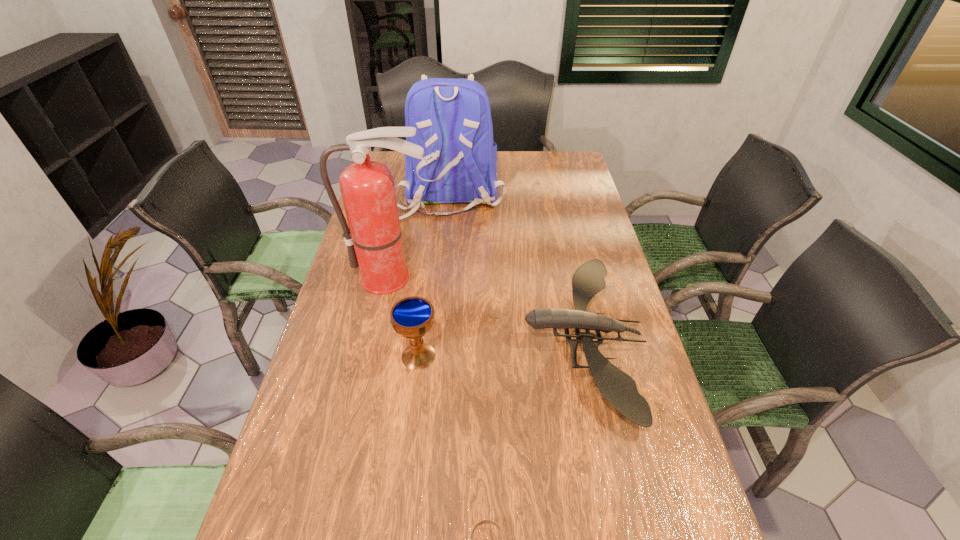
The height and width of the screenshot is (540, 960). Find the location of `fire extinguisher`. fire extinguisher is located at coordinates (374, 240).

This screenshot has width=960, height=540. I want to click on the farthest object, so click(452, 117).

Where is `chalice`? chalice is located at coordinates (412, 317).

At what (x,y) coordinates should I click in order to perform the action: click on the fourth tallest object. Please return your answer as a coordinate pair (x, y). Looking at the image, I should click on (618, 388).

Image resolution: width=960 pixels, height=540 pixels. What are the coordinates of `drone` in the screenshot? It's located at point(618,388).

This screenshot has width=960, height=540. I want to click on vacant space situated with the handle and hose on the fire extinguisher, so click(368, 393).

I want to click on free space located 0.360m on the back of the backpack, so click(441, 292).

Where is `vacant space located on the right of the chalice`? This screenshot has width=960, height=540. vacant space located on the right of the chalice is located at coordinates (507, 356).

I want to click on vacant space located 0.060m at the head of the second shortest object, so click(x=501, y=339).

Where is `free space located at the head of the second shortest object`? This screenshot has height=540, width=960. free space located at the head of the second shortest object is located at coordinates click(x=465, y=339).